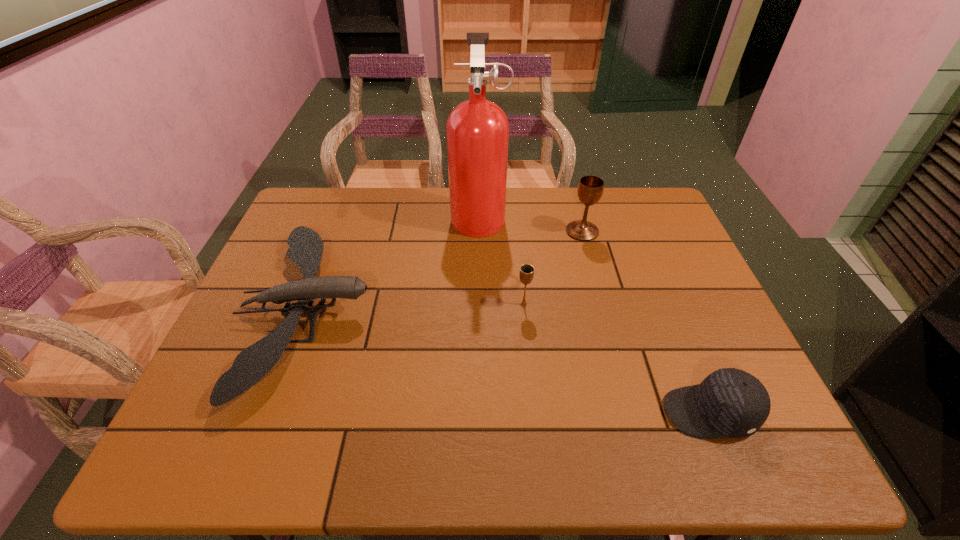
Identify the location of free space located 0.140m on the right of the shorter chalice. [585, 305].

Image resolution: width=960 pixels, height=540 pixels. Identify the location of free location located at the head of the drone. (393, 311).

Identify the location of free location located 0.060m at the front of the rightmost object where the brim is located. (635, 413).

At what (x,y) coordinates should I click in order to perform the action: click on free region located 0.240m at the front of the rightmost object where the brim is located. Please return your answer as a coordinate pair (x, y). This screenshot has width=960, height=540. Looking at the image, I should click on (548, 413).

The width and height of the screenshot is (960, 540). What are the coordinates of `vacant space situated 0.110m at the front of the rightmost object where the brim is located` in the screenshot? It's located at (611, 413).

Locate an element on the screen. This screenshot has width=960, height=540. fire extinguisher located at the far edge is located at coordinates (477, 130).

Find the location of a particular element. This screenshot has width=960, height=540. chalice at the far edge is located at coordinates pos(590,188).

Locate an element on the screen. The image size is (960, 540). object that is at the near edge is located at coordinates (729, 403).

Locate an element on the screen. This screenshot has height=540, width=960. object located in the left edge section of the desktop is located at coordinates (306, 247).

Where is `object located at the right edge`? object located at the right edge is located at coordinates (729, 403).